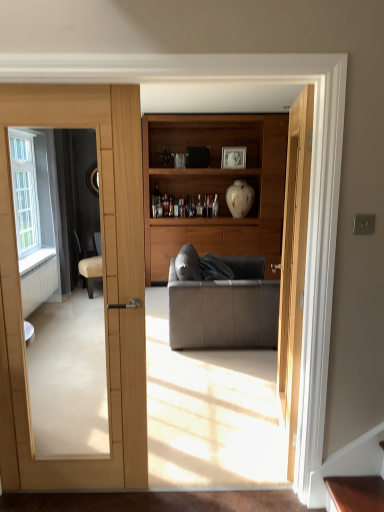
What do you see at coordinates (348, 464) in the screenshot?
I see `white glossy stairwell at lower right` at bounding box center [348, 464].

At what (x,y) coordinates should I click in order to perform the action: click on white glossy stairwell at lower right. Please return your answer as a coordinate pair (x, y). This screenshot has height=512, width=384. Looking at the image, I should click on (348, 464).

Identify the location of white glossy stairwell at lower right. This screenshot has width=384, height=512. (348, 464).